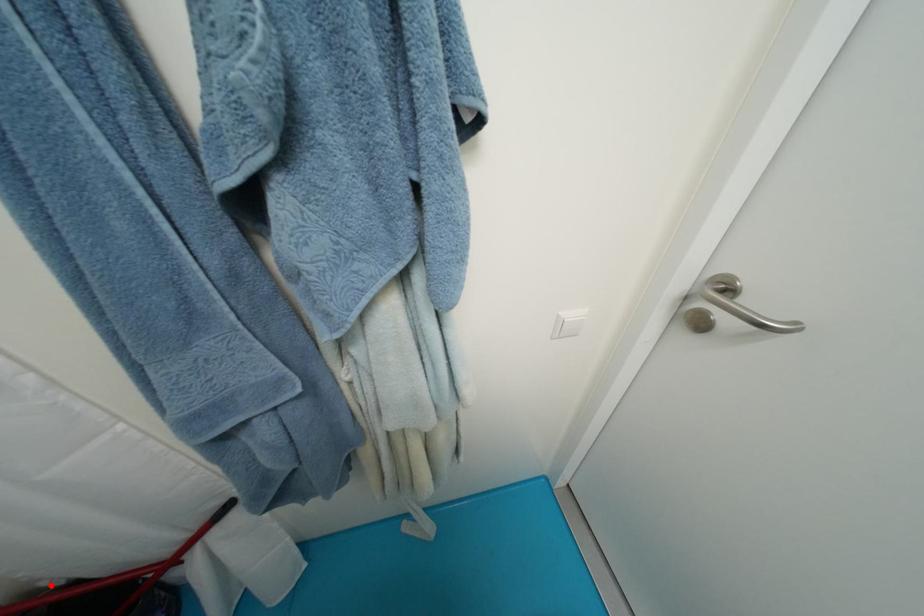
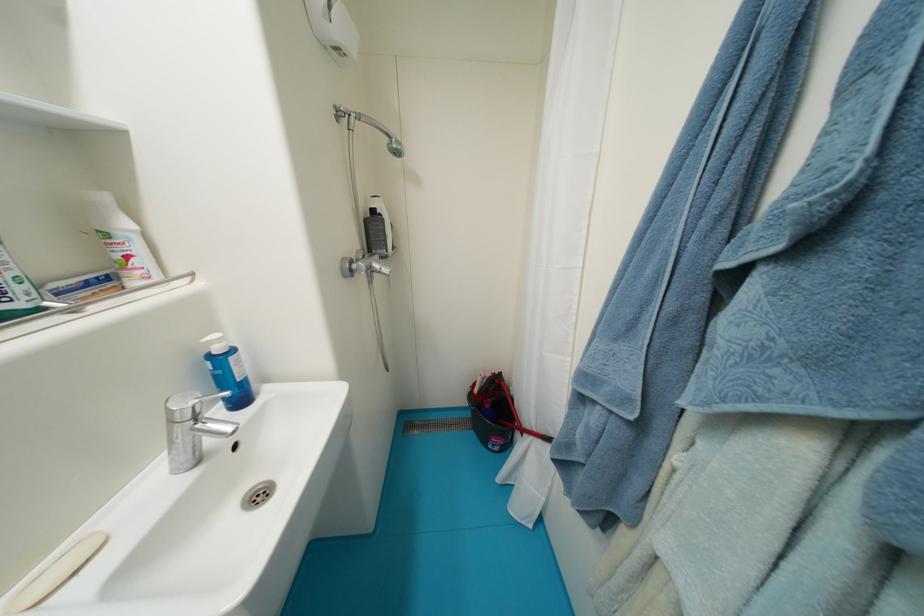
In the second image, find the point that corresponds to the highlighted location in the first image.

(517, 390)